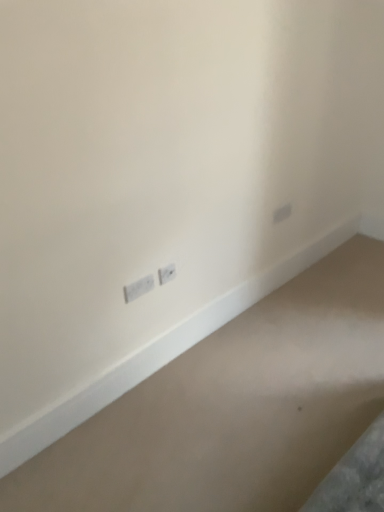
In order to face smooth beige carpet at bottom, should I rotate leftwards or rightwards?

You should rotate right by 13.842 degrees.

This screenshot has width=384, height=512. In order to click on white plastic power plugs and sockets at lower left, the 2th power plugs and sockets when ordered from right to left in this screenshot , I will do `click(138, 288)`.

Considering the positions of objects white plastic power plugs and sockets at center, the 2th power plugs and sockets in the left-to-right sequence, and smooth beige carpet at bottom in the image provided, who is behind, white plastic power plugs and sockets at center, the 2th power plugs and sockets in the left-to-right sequence, or smooth beige carpet at bottom?

white plastic power plugs and sockets at center, the 2th power plugs and sockets in the left-to-right sequence, is more distant.

Can you confirm if white plastic power plugs and sockets at center, which is the first power plugs and sockets from right to left, is positioned to the left of smooth beige carpet at bottom?

Yes.

In the scene shown: Is white plastic power plugs and sockets at center, which is the first power plugs and sockets from right to left, located outside smooth beige carpet at bottom?

Indeed, white plastic power plugs and sockets at center, which is the first power plugs and sockets from right to left, is completely outside smooth beige carpet at bottom.

Based on the photo, is white plastic power plugs and sockets at lower left, the 1th power plugs and sockets positioned from the left, closer to the viewer compared to white plastic power plugs and sockets at center, the 2th power plugs and sockets in the left-to-right sequence?

Yes, it is.

Can you confirm if white plastic power plugs and sockets at lower left, the 1th power plugs and sockets positioned from the left, is shorter than white plastic power plugs and sockets at center, which is the first power plugs and sockets from right to left?

Indeed, white plastic power plugs and sockets at lower left, the 1th power plugs and sockets positioned from the left, has a lesser height compared to white plastic power plugs and sockets at center, which is the first power plugs and sockets from right to left.

Does white plastic power plugs and sockets at lower left, the 1th power plugs and sockets positioned from the left, have a larger size compared to white plastic power plugs and sockets at center, the 2th power plugs and sockets in the left-to-right sequence?

Yes, white plastic power plugs and sockets at lower left, the 1th power plugs and sockets positioned from the left, is bigger than white plastic power plugs and sockets at center, the 2th power plugs and sockets in the left-to-right sequence.

From a real-world perspective, between white plastic power plugs and sockets at lower left, the 2th power plugs and sockets when ordered from right to left, and white plastic power plugs and sockets at center, the 2th power plugs and sockets in the left-to-right sequence, who is vertically higher?

In real-world perspective, white plastic power plugs and sockets at center, the 2th power plugs and sockets in the left-to-right sequence, is above.

How distant is smooth beige carpet at bottom from white plastic power plugs and sockets at lower left, the 2th power plugs and sockets when ordered from right to left?

They are 27.98 inches apart.

Can you confirm if smooth beige carpet at bottom is wider than white plastic power plugs and sockets at lower left, the 2th power plugs and sockets when ordered from right to left?

Yes, smooth beige carpet at bottom is wider than white plastic power plugs and sockets at lower left, the 2th power plugs and sockets when ordered from right to left.

Is smooth beige carpet at bottom positioned far away from white plastic power plugs and sockets at lower left, the 1th power plugs and sockets positioned from the left?

smooth beige carpet at bottom is near white plastic power plugs and sockets at lower left, the 1th power plugs and sockets positioned from the left, not far away.

Can you confirm if smooth beige carpet at bottom is positioned to the right of white plastic power plugs and sockets at lower left, the 2th power plugs and sockets when ordered from right to left?

Indeed, smooth beige carpet at bottom is positioned on the right side of white plastic power plugs and sockets at lower left, the 2th power plugs and sockets when ordered from right to left.

Which is more to the left, white plastic power plugs and sockets at center, the 2th power plugs and sockets in the left-to-right sequence, or white plastic power plugs and sockets at lower left, the 2th power plugs and sockets when ordered from right to left?

From the viewer's perspective, white plastic power plugs and sockets at lower left, the 2th power plugs and sockets when ordered from right to left, appears more on the left side.

Considering their positions, is white plastic power plugs and sockets at center, which is the first power plugs and sockets from right to left, located in front of or behind white plastic power plugs and sockets at lower left, the 2th power plugs and sockets when ordered from right to left?

white plastic power plugs and sockets at center, which is the first power plugs and sockets from right to left, is behind white plastic power plugs and sockets at lower left, the 2th power plugs and sockets when ordered from right to left.

Is white plastic power plugs and sockets at center, the 2th power plugs and sockets in the left-to-right sequence, bigger than white plastic power plugs and sockets at lower left, the 1th power plugs and sockets positioned from the left?

No.

Could you tell me if white plastic power plugs and sockets at center, which is the first power plugs and sockets from right to left, is turned towards white plastic power plugs and sockets at lower left, the 2th power plugs and sockets when ordered from right to left?

No.

The width and height of the screenshot is (384, 512). I want to click on concrete on the right of the white plastic power plugs and sockets at lower left, the 1th power plugs and sockets positioned from the left, so click(234, 407).

What's the angular difference between white plastic power plugs and sockets at lower left, the 1th power plugs and sockets positioned from the left, and smooth beige carpet at bottom's facing directions?

white plastic power plugs and sockets at lower left, the 1th power plugs and sockets positioned from the left, and smooth beige carpet at bottom are facing 177 degrees away from each other.

Is smooth beige carpet at bottom at the back of white plastic power plugs and sockets at lower left, the 2th power plugs and sockets when ordered from right to left?

white plastic power plugs and sockets at lower left, the 2th power plugs and sockets when ordered from right to left, does not have its back to smooth beige carpet at bottom.

Does white plastic power plugs and sockets at lower left, the 1th power plugs and sockets positioned from the left, have a smaller size compared to smooth beige carpet at bottom?

Yes.

Is smooth beige carpet at bottom inside the boundaries of white plastic power plugs and sockets at center, the 2th power plugs and sockets in the left-to-right sequence, or outside?

smooth beige carpet at bottom cannot be found inside white plastic power plugs and sockets at center, the 2th power plugs and sockets in the left-to-right sequence.

Is smooth beige carpet at bottom taller or shorter than white plastic power plugs and sockets at center, the 2th power plugs and sockets in the left-to-right sequence?

smooth beige carpet at bottom is shorter than white plastic power plugs and sockets at center, the 2th power plugs and sockets in the left-to-right sequence.

Which of these two, smooth beige carpet at bottom or white plastic power plugs and sockets at center, the 2th power plugs and sockets in the left-to-right sequence, is wider?

With larger width is smooth beige carpet at bottom.

In the image, is smooth beige carpet at bottom on the left side or the right side of white plastic power plugs and sockets at center, which is the first power plugs and sockets from right to left?

In the image, smooth beige carpet at bottom appears on the right side of white plastic power plugs and sockets at center, which is the first power plugs and sockets from right to left.

The width and height of the screenshot is (384, 512). Find the location of `the 2nd power plugs and sockets above when counting from the smooth beige carpet at bottom (from the image's perspective)`. the 2nd power plugs and sockets above when counting from the smooth beige carpet at bottom (from the image's perspective) is located at coordinates (167, 273).

Identify the location of power plugs and sockets that is on the right side of white plastic power plugs and sockets at lower left, the 1th power plugs and sockets positioned from the left. The image size is (384, 512). (167, 273).

Based on their spatial positions, is white plastic power plugs and sockets at center, the 2th power plugs and sockets in the left-to-right sequence, or smooth beige carpet at bottom closer to white plastic power plugs and sockets at lower left, the 1th power plugs and sockets positioned from the left?

Among the two, white plastic power plugs and sockets at center, the 2th power plugs and sockets in the left-to-right sequence, is located nearer to white plastic power plugs and sockets at lower left, the 1th power plugs and sockets positioned from the left.

Looking at the image, which one is located further to smooth beige carpet at bottom, white plastic power plugs and sockets at lower left, the 2th power plugs and sockets when ordered from right to left, or white plastic power plugs and sockets at center, which is the first power plugs and sockets from right to left?

white plastic power plugs and sockets at center, which is the first power plugs and sockets from right to left, is further to smooth beige carpet at bottom.

When comparing their distances from white plastic power plugs and sockets at center, the 2th power plugs and sockets in the left-to-right sequence, does smooth beige carpet at bottom or white plastic power plugs and sockets at lower left, the 1th power plugs and sockets positioned from the left, seem further?

smooth beige carpet at bottom is positioned further to the anchor white plastic power plugs and sockets at center, the 2th power plugs and sockets in the left-to-right sequence.

From the image, which object appears to be farther from white plastic power plugs and sockets at lower left, the 1th power plugs and sockets positioned from the left, smooth beige carpet at bottom or white plastic power plugs and sockets at center, the 2th power plugs and sockets in the left-to-right sequence?

smooth beige carpet at bottom is further to white plastic power plugs and sockets at lower left, the 1th power plugs and sockets positioned from the left.

Which object lies further to the anchor point smooth beige carpet at bottom, white plastic power plugs and sockets at center, which is the first power plugs and sockets from right to left, or white plastic power plugs and sockets at lower left, the 1th power plugs and sockets positioned from the left?

Among the two, white plastic power plugs and sockets at center, which is the first power plugs and sockets from right to left, is located further to smooth beige carpet at bottom.

Which object lies nearer to the anchor point white plastic power plugs and sockets at center, which is the first power plugs and sockets from right to left, white plastic power plugs and sockets at lower left, the 1th power plugs and sockets positioned from the left, or smooth beige carpet at bottom?

Based on the image, white plastic power plugs and sockets at lower left, the 1th power plugs and sockets positioned from the left, appears to be nearer to white plastic power plugs and sockets at center, which is the first power plugs and sockets from right to left.

Where is `power plugs and sockets between smooth beige carpet at bottom and white plastic power plugs and sockets at center, which is the first power plugs and sockets from right to left, in the front-back direction`? power plugs and sockets between smooth beige carpet at bottom and white plastic power plugs and sockets at center, which is the first power plugs and sockets from right to left, in the front-back direction is located at coordinates (138, 288).